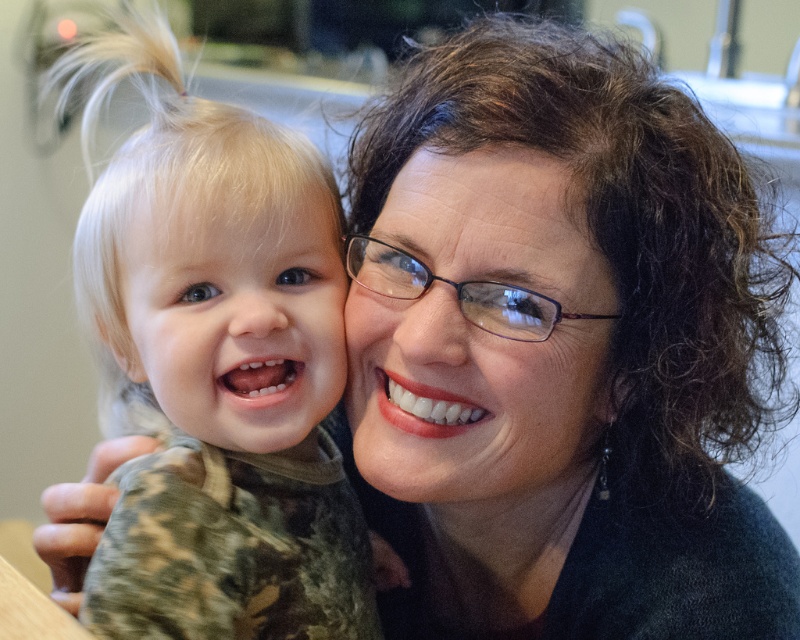
Does camouflage fabric toddler at left lie in front of blonde hair at left?

That is True.

Between camouflage fabric toddler at left and blonde hair at left, which one is positioned higher?

blonde hair at left is above.

Describe the element at coordinates (222, 372) in the screenshot. Image resolution: width=800 pixels, height=640 pixels. I see `camouflage fabric toddler at left` at that location.

Find the location of a particular element. camouflage fabric toddler at left is located at coordinates (222, 372).

Looking at this image, which is more to the right, camouflage fabric toddler at left or smooth skin face at center?

smooth skin face at center

Is the position of camouflage fabric toddler at left more distant than that of smooth skin face at center?

No, camouflage fabric toddler at left is closer to the viewer.

Is point (285, 292) farther from viewer compared to point (564, 422)?

No, it is in front of (564, 422).

This screenshot has width=800, height=640. In order to click on camouflage fabric toddler at left in this screenshot , I will do `click(222, 372)`.

Who is positioned more to the left, smooth skin face at center or blonde hair at left?

From the viewer's perspective, blonde hair at left appears more on the left side.

In order to click on smooth skin face at center in this screenshot , I will do `click(462, 396)`.